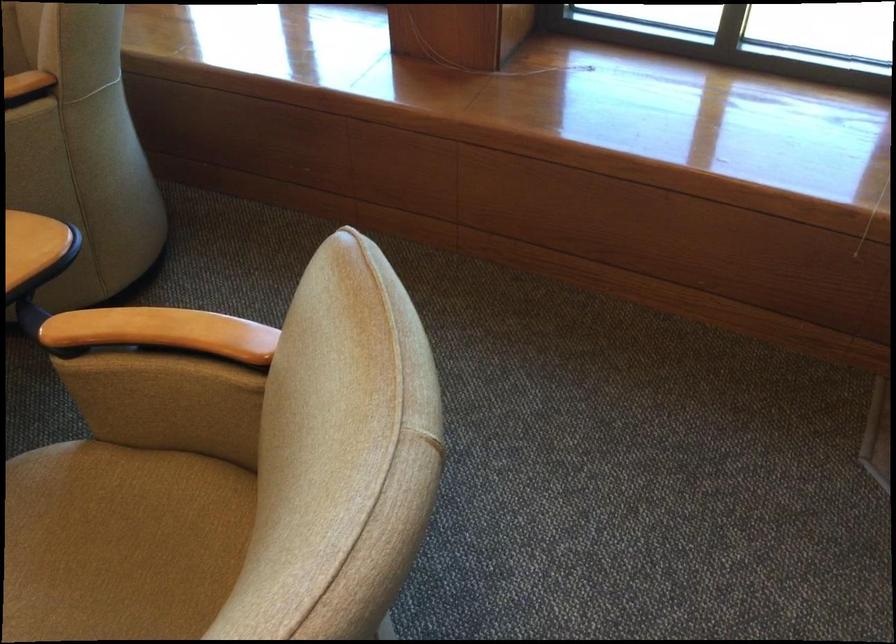
You are a GUI agent. You are given a task and a screenshot of the screen. Output one action in this format:
    pyautogui.click(x=<x>, y=<y>)
    Task: Click on the tan chair sitting surface
    
    Given the screenshot: What is the action you would take?
    pyautogui.click(x=121, y=542)